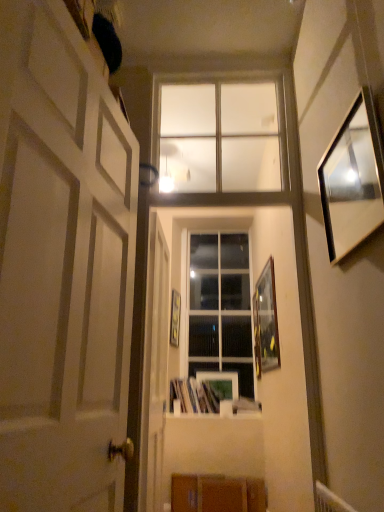
This screenshot has height=512, width=384. Describe the element at coordinates (223, 136) in the screenshot. I see `clear glass window at upper center, arranged as the 2th window when ordered from the bottom` at that location.

Find the location of a particular element. white matte door at left, the second door in the back-to-front sequence is located at coordinates (62, 267).

The image size is (384, 512). Describe the element at coordinates (62, 267) in the screenshot. I see `white matte door at left, the second door in the back-to-front sequence` at that location.

The height and width of the screenshot is (512, 384). What are the coordinates of `white glossy door at center, which appears as the 2th door when viewed from the front` in the screenshot? It's located at (155, 366).

The image size is (384, 512). Find the location of `clear glass window at upper center, placed as the 1th window when sorted from top to bottom`. clear glass window at upper center, placed as the 1th window when sorted from top to bottom is located at coordinates (223, 136).

Looking at their sizes, would you say wooden picture frame at right, the 3th picture frame from the back, is wider or thinner than matte wooden picture frame at center, the first picture frame viewed from the back?

In the image, wooden picture frame at right, the 3th picture frame from the back, appears to be wider than matte wooden picture frame at center, the first picture frame viewed from the back.

This screenshot has width=384, height=512. I want to click on picture frame that is the 2nd object located in front of the matte wooden picture frame at center, placed as the 3th picture frame when sorted from right to left, so pyautogui.click(x=266, y=322).

From a real-world perspective, between wooden picture frame at right, the 3th picture frame from the back, and matte wooden picture frame at center, placed as the 3th picture frame when sorted from right to left, who is vertically lower?

In real-world perspective, matte wooden picture frame at center, placed as the 3th picture frame when sorted from right to left, is lower.

In the scene shown: From the image's perspective, is wooden picture frame at right, the 1th picture frame in the right-to-left sequence, beneath matte wooden picture frame at center, the 2th picture frame when ordered from left to right?

No, from the image's perspective, wooden picture frame at right, the 1th picture frame in the right-to-left sequence, is not below matte wooden picture frame at center, the 2th picture frame when ordered from left to right.

Does wooden picture frame at center, which ranks as the third picture frame in front-to-back order, have a greater height compared to wooden picture frame at right, the 3th picture frame from the back?

In fact, wooden picture frame at center, which ranks as the third picture frame in front-to-back order, may be shorter than wooden picture frame at right, the 3th picture frame from the back.

Which point is more forward, (177, 323) or (271, 344)?

Point (271, 344)

Is wooden picture frame at right, the fourth picture frame in the left-to-right sequence, at the back of wooden picture frame at center, which appears as the fourth picture frame when viewed from the right?

wooden picture frame at center, which appears as the fourth picture frame when viewed from the right, does not have its back to wooden picture frame at right, the fourth picture frame in the left-to-right sequence.

Is matte wooden picture frame at center, placed as the 3th picture frame when sorted from right to left, positioned beyond the bounds of clear glass window at upper center, which ranks as the 1th window in front-to-back order?

Yes, matte wooden picture frame at center, placed as the 3th picture frame when sorted from right to left, is located beyond the bounds of clear glass window at upper center, which ranks as the 1th window in front-to-back order.

Can you confirm if matte wooden picture frame at center, marked as the 4th picture frame in a front-to-back arrangement, is wider than clear glass window at upper center, the second window viewed from the back?

In fact, matte wooden picture frame at center, marked as the 4th picture frame in a front-to-back arrangement, might be narrower than clear glass window at upper center, the second window viewed from the back.

Is matte wooden picture frame at center, placed as the 3th picture frame when sorted from right to left, facing towards clear glass window at upper center, which ranks as the 1th window in front-to-back order?

No, matte wooden picture frame at center, placed as the 3th picture frame when sorted from right to left, does not turn towards clear glass window at upper center, which ranks as the 1th window in front-to-back order.

Considering the relative sizes of white glossy door at center, which is the first door from back to front, and wooden picture frame at center, marked as the second picture frame in a back-to-front arrangement, in the image provided, is white glossy door at center, which is the first door from back to front, smaller than wooden picture frame at center, marked as the second picture frame in a back-to-front arrangement,?

Incorrect, white glossy door at center, which is the first door from back to front, is not smaller in size than wooden picture frame at center, marked as the second picture frame in a back-to-front arrangement.

From the image's perspective, count 1st picture frames upward from the white glossy door at center, which is the first door from back to front, and point to it. Please provide its 2D coordinates.

[(175, 318)]

Based on the photo, from a real-world perspective, relative to wooden picture frame at center, marked as the second picture frame in a back-to-front arrangement, is white glossy door at center, which appears as the 2th door when viewed from the front, vertically above or below?

white glossy door at center, which appears as the 2th door when viewed from the front, is below wooden picture frame at center, marked as the second picture frame in a back-to-front arrangement.

Which is closer to the camera, (159, 288) or (175, 304)?

Positioned in front is point (159, 288).

Which is more to the left, wooden at lower center or matte wooden picture frame at center, marked as the 4th picture frame in a front-to-back arrangement?

matte wooden picture frame at center, marked as the 4th picture frame in a front-to-back arrangement.

From the image's perspective, between wooden at lower center and matte wooden picture frame at center, placed as the 3th picture frame when sorted from right to left, who is located below?

wooden at lower center, from the image's perspective.

Is wooden at lower center spatially inside matte wooden picture frame at center, placed as the 3th picture frame when sorted from right to left, or outside of it?

wooden at lower center is not inside matte wooden picture frame at center, placed as the 3th picture frame when sorted from right to left, it's outside.

Considering the sizes of objects wooden at lower center and matte wooden picture frame at center, the first picture frame viewed from the back, in the image provided, who is smaller, wooden at lower center or matte wooden picture frame at center, the first picture frame viewed from the back,?

matte wooden picture frame at center, the first picture frame viewed from the back, is smaller.

From a real-world perspective, is matte wooden picture frame at center, the 2th picture frame when ordered from left to right, located higher than white matte door at left, which appears as the first door when viewed from the front?

Incorrect, from a real-world perspective, matte wooden picture frame at center, the 2th picture frame when ordered from left to right, is lower than white matte door at left, which appears as the first door when viewed from the front.

Which object is closer to the camera, matte wooden picture frame at center, the first picture frame viewed from the back, or white matte door at left, the second door in the back-to-front sequence?

white matte door at left, the second door in the back-to-front sequence.

Is matte wooden picture frame at center, the 2th picture frame when ordered from left to right, placed right next to white matte door at left, which appears as the first door when viewed from the front?

No, matte wooden picture frame at center, the 2th picture frame when ordered from left to right, is not in contact with white matte door at left, which appears as the first door when viewed from the front.

Is white glossy door at center, which appears as the 2th door when viewed from the front, located outside matte black picture frame at upper right, positioned as the second picture frame in right-to-left order?

white glossy door at center, which appears as the 2th door when viewed from the front, is positioned outside matte black picture frame at upper right, positioned as the second picture frame in right-to-left order.

From the image's perspective, would you say white glossy door at center, which is the first door from back to front, is shown under matte black picture frame at upper right, the first picture frame positioned from the front?

Correct, white glossy door at center, which is the first door from back to front, appears lower than matte black picture frame at upper right, the first picture frame positioned from the front, in the image.

Looking at this image, between white glossy door at center, which is the first door from back to front, and matte black picture frame at upper right, the first picture frame positioned from the front, which one has larger width?

With larger width is white glossy door at center, which is the first door from back to front.

Is point (149, 492) closer to viewer compared to point (323, 166)?

That is False.

I want to click on picture frame that appears below the wooden picture frame at right, the fourth picture frame in the left-to-right sequence (from a real-world perspective), so click(x=219, y=386).

Find the location of a particular element. the 3rd picture frame counting from the right side of the wooden picture frame at center, which appears as the fourth picture frame when viewed from the right is located at coordinates (266, 322).

Estimate the real-world distances between objects in this image. Which object is further from wooden at lower center, matte wooden picture frame at center, marked as the 4th picture frame in a front-to-back arrangement, or matte black picture frame at upper right, positioned as the 3th picture frame in left-to-right order?

matte black picture frame at upper right, positioned as the 3th picture frame in left-to-right order.

Based on the photo, from the image, which object appears to be farther from white glossy door at center, which is the first door from back to front, white matte door at left, the second door in the back-to-front sequence, or wooden picture frame at right, the 3th picture frame from the back?

white matte door at left, the second door in the back-to-front sequence, is further to white glossy door at center, which is the first door from back to front.

Which object lies nearer to the anchor point wooden at lower center, white glossy door at center, which appears as the 2th door when viewed from the front, or clear glass window at center, acting as the 2th window starting from the top?

white glossy door at center, which appears as the 2th door when viewed from the front.

Which object lies nearer to the anchor point wooden at lower center, wooden picture frame at right, the 3th picture frame from the back, or clear glass window at upper center, arranged as the 2th window when ordered from the bottom?

The object closer to wooden at lower center is wooden picture frame at right, the 3th picture frame from the back.

When comparing their distances from clear glass window at upper center, arranged as the 2th window when ordered from the bottom, does wooden picture frame at right, the 2th picture frame from the front, or matte wooden picture frame at center, the 2th picture frame when ordered from left to right, seem further?

matte wooden picture frame at center, the 2th picture frame when ordered from left to right, is positioned further to the anchor clear glass window at upper center, arranged as the 2th window when ordered from the bottom.

When comparing their distances from wooden picture frame at right, the fourth picture frame in the left-to-right sequence, does wooden at lower center or white matte door at left, which appears as the first door when viewed from the front, seem closer?

Based on the image, wooden at lower center appears to be nearer to wooden picture frame at right, the fourth picture frame in the left-to-right sequence.

From the image, which object appears to be nearer to clear glass window at center, which is counted as the 2th window, starting from the front, wooden at lower center or wooden picture frame at center, which ranks as the third picture frame in front-to-back order?

The object closer to clear glass window at center, which is counted as the 2th window, starting from the front, is wooden picture frame at center, which ranks as the third picture frame in front-to-back order.

Looking at the image, which one is located closer to matte black picture frame at upper right, the 4th picture frame viewed from the back, clear glass window at upper center, the second window viewed from the back, or clear glass window at center, which is counted as the 2th window, starting from the front?

clear glass window at upper center, the second window viewed from the back.

You are a GUI agent. You are given a task and a screenshot of the screen. Output one action in this format:
    pyautogui.click(x=<x>, y=<y>)
    Task: Click on the door between matte black picture frame at upper right, positioned as the 3th picture frame in left-to-right order, and clear glass window at center, acting as the 2th window starting from the top, along the z-axis
    The width and height of the screenshot is (384, 512).
    Given the screenshot: What is the action you would take?
    pyautogui.click(x=155, y=366)

The image size is (384, 512). Identify the location of window between wooden picture frame at right, the 2th picture frame from the front, and wooden at lower center from top to bottom. (220, 307).

This screenshot has height=512, width=384. In order to click on door located between matte black picture frame at upper right, the 4th picture frame viewed from the back, and wooden picture frame at right, the 1th picture frame in the right-to-left sequence, in the depth direction in this screenshot , I will do `click(155, 366)`.

At what (x,y) coordinates should I click in order to perform the action: click on shelf between white matte door at left, the second door in the back-to-front sequence, and wooden picture frame at center, the 1th picture frame viewed from the left, from front to back. Please return your answer as a coordinate pair (x, y). Looking at the image, I should click on (217, 494).